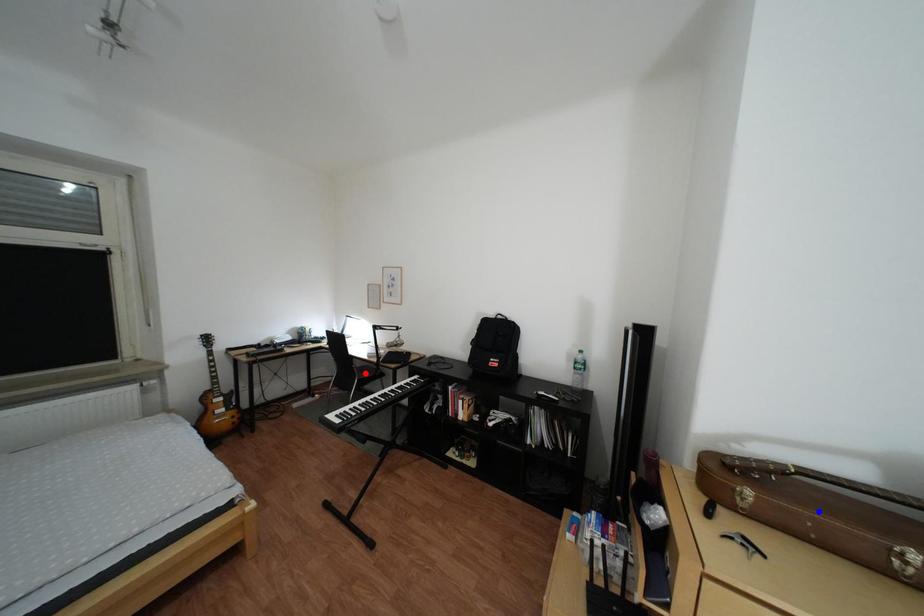
Question: Which of the two points in the image is closer to the camera?

Choices:
 (A) Blue point is closer.
 (B) Red point is closer.

Answer: (A)